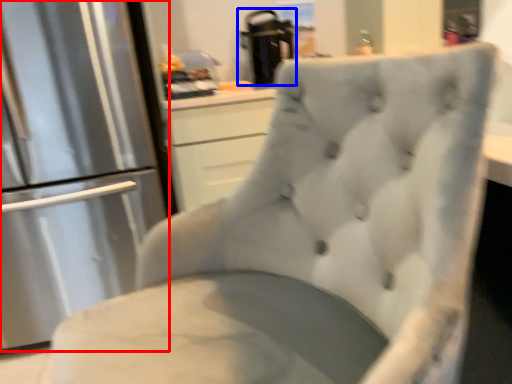
Question: Which object appears closest to the camera in this image, refrigerator (highlighted by a red box) or appliance (highlighted by a blue box)?

Choices:
 (A) refrigerator
 (B) appliance

Answer: (A)